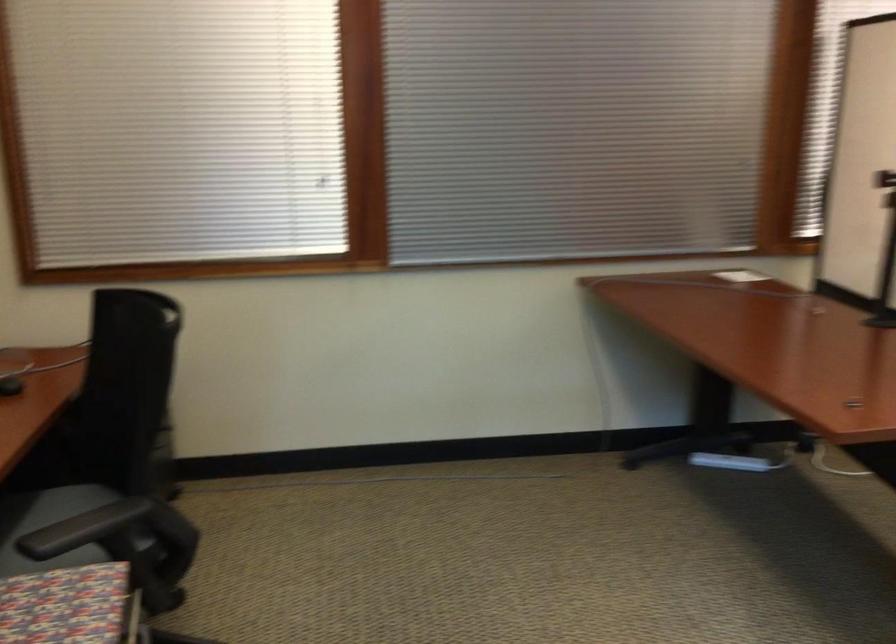
Identify the location of white power strip. Image resolution: width=896 pixels, height=644 pixels. (730, 462).